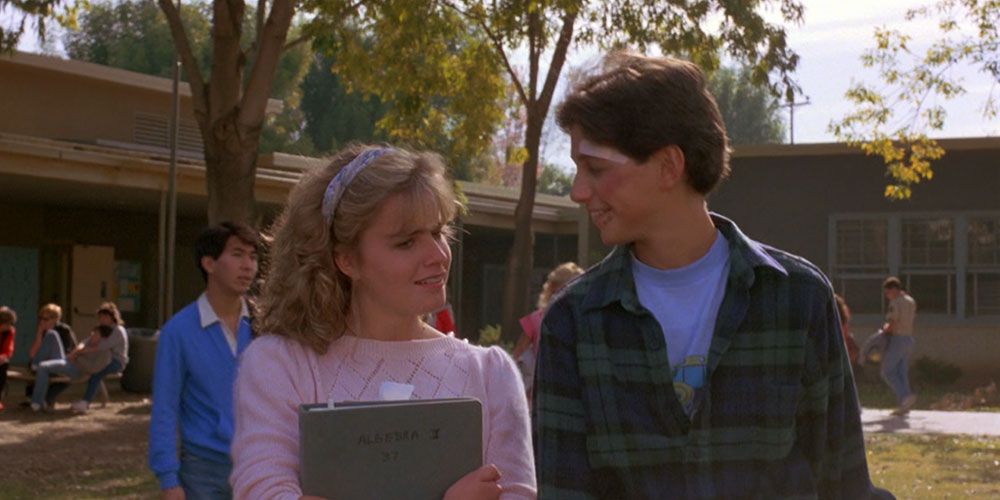
Locate an element on the screen. window pane is located at coordinates tap(937, 260).